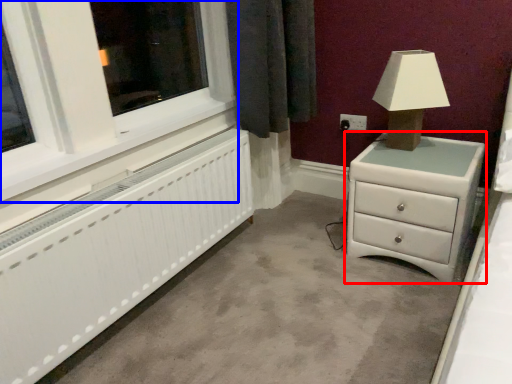
Question: Which object is further to the camera taking this photo, chest of drawers (highlighted by a red box) or window frame (highlighted by a blue box)?

Choices:
 (A) chest of drawers
 (B) window frame

Answer: (A)